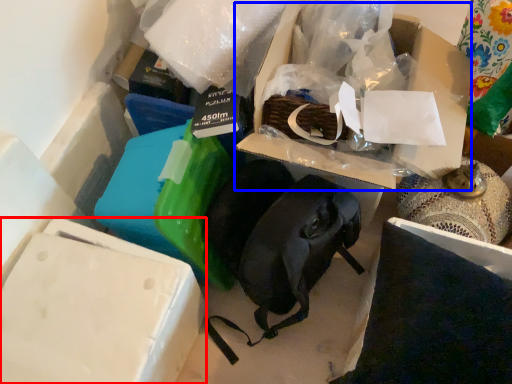
Question: Which object is closer to the camera taking this photo, box (highlighted by a red box) or storage box (highlighted by a blue box)?

Choices:
 (A) box
 (B) storage box

Answer: (A)